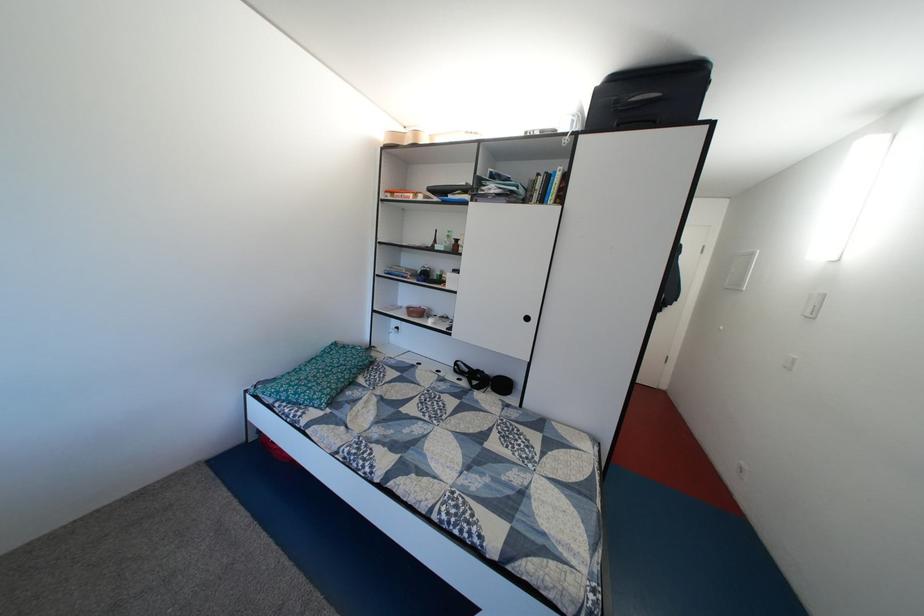
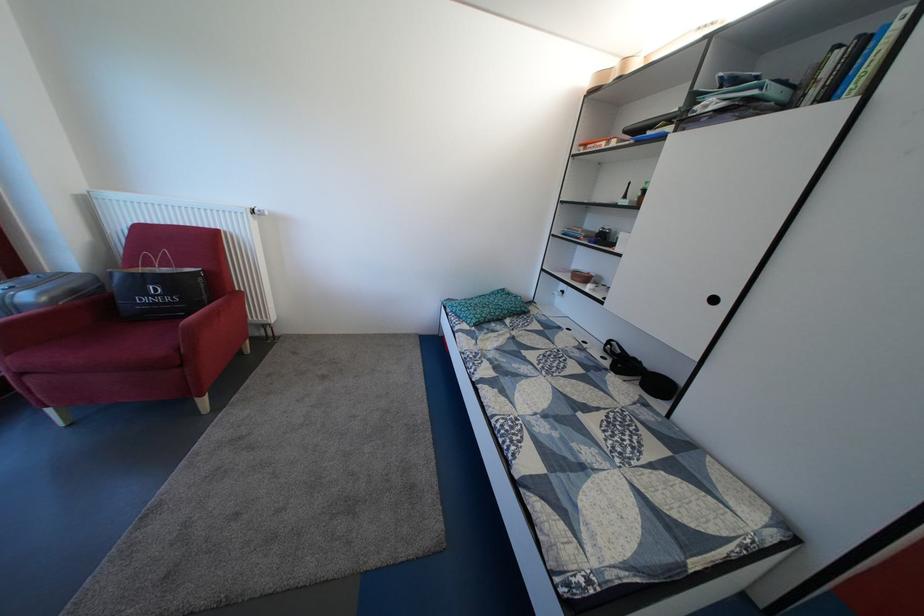
Where in the second image is the point corresponding to pixel 337 383 from the first image?

(494, 314)